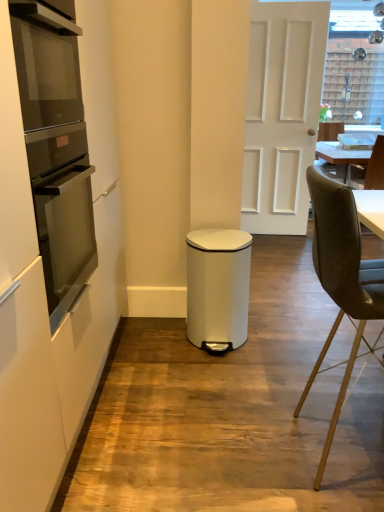
Find the location of `free point to the left of leather-like brown chair at right, arranged as the first chair when viewed from the front`. free point to the left of leather-like brown chair at right, arranged as the first chair when viewed from the front is located at coordinates (240, 442).